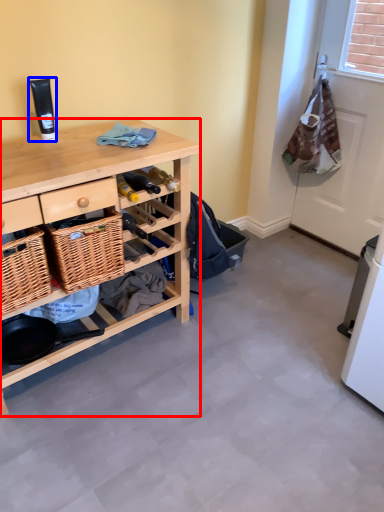
Question: Which object appears closest to the camera in this image, desk (highlighted by a red box) or toiletry (highlighted by a blue box)?

Choices:
 (A) desk
 (B) toiletry

Answer: (A)